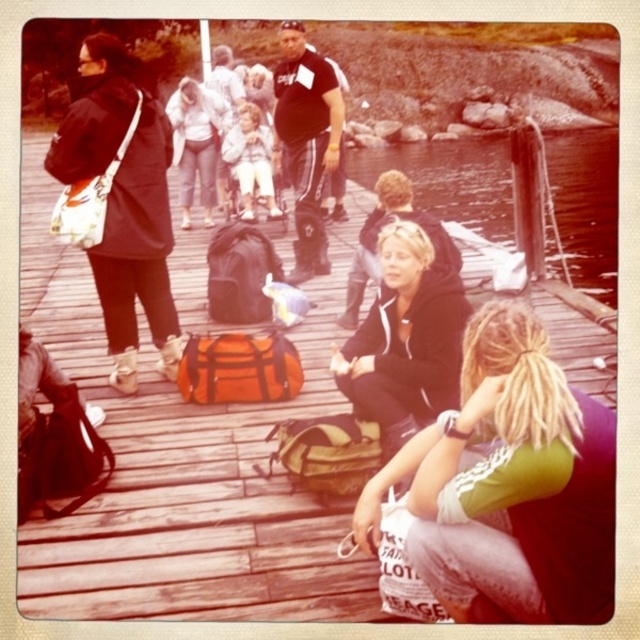
Question: Where is black matte jacket at center located in relation to matte white shirt at upper center in the image?

Choices:
 (A) below
 (B) above

Answer: (A)

Question: Which object appears closest to the camera in this image?

Choices:
 (A) matte white shirt at upper center
 (B) wooden dock at center

Answer: (B)

Question: Does green jersey at lower right appear over clear water at dock center?

Choices:
 (A) no
 (B) yes

Answer: (A)

Question: Which point is farther to the camera?

Choices:
 (A) (467, 566)
 (B) (512, 237)
 (C) (404, 321)

Answer: (B)

Question: Which point appears closest to the camera in this image?

Choices:
 (A) (205, 154)
 (B) (20, 573)
 (C) (561, 429)

Answer: (C)

Question: Can you confirm if wooden dock at center is positioned to the left of matte black jacket at left?

Choices:
 (A) no
 (B) yes

Answer: (B)